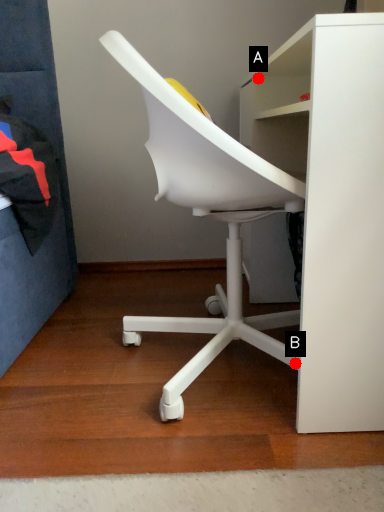
Question: Two points are circled on the image, labeled by A and B beside each circle. Which point is closer to the camera?

Choices:
 (A) A is closer
 (B) B is closer

Answer: (B)